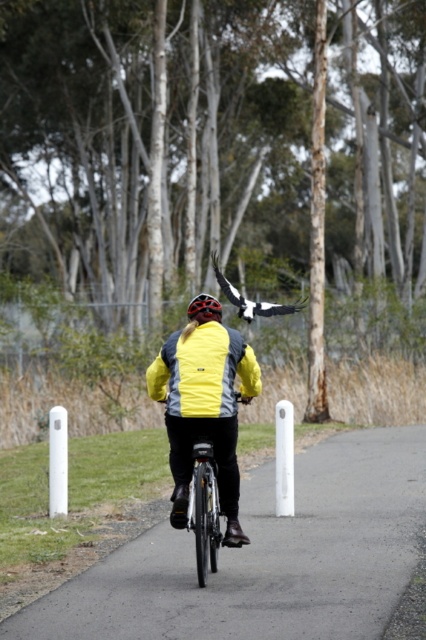
You are a delivery person who needs to ensure your shiny black bicycle at center can fit through a narrow tunnel entrance that is the same height as the asphalt road at center. Will the bicycle fit through the entrance?

The asphalt road at center is not as tall as shiny black bicycle at center, meaning the bicycle is taller. Since the tunnel entrance is the same height as the asphalt road, the bicycle will not fit through the entrance due to its greater height.

You are a delivery robot that is 0.8 meters wide. You need to pass through the path between the asphalt road at center and the matte black helmet at center. Can you fit through the path?

The asphalt road at center might be wider than matte black helmet at center, so the path between them is likely wider than 0.8 meters. Therefore, the delivery robot can fit through the path between the asphalt road at center and the matte black helmet at center.